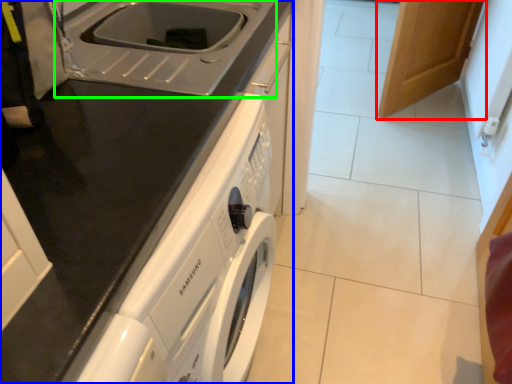
Question: Which is nearer to the cabinetry (highlighted by a red box)? home appliance (highlighted by a blue box) or sink (highlighted by a green box).

Choices:
 (A) home appliance
 (B) sink

Answer: (B)